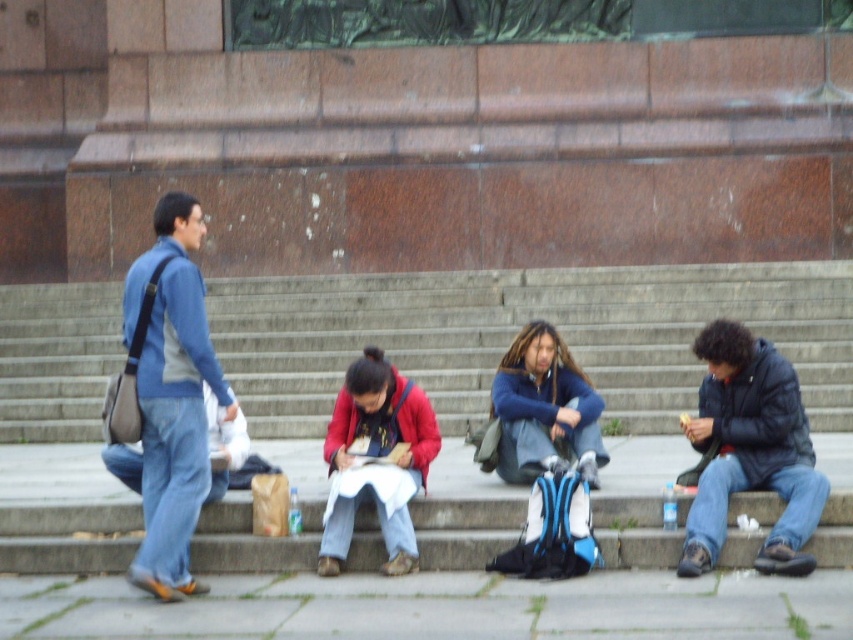
The image size is (853, 640). Identify the location of blue denim jeans at left. (172, 396).

Does point (202, 320) come in front of point (389, 488)?

Yes, it is in front of point (389, 488).

Is point (173, 259) closer to viewer compared to point (412, 536)?

No, (173, 259) is further to viewer.

The image size is (853, 640). I want to click on blue denim jeans at left, so click(172, 396).

Can you confirm if dark blue jacket at lower right is positioned below matte red jacket at center?

Actually, dark blue jacket at lower right is above matte red jacket at center.

In the scene shown: Who is taller, dark blue jacket at lower right or matte red jacket at center?

Standing taller between the two is dark blue jacket at lower right.

Is point (763, 552) positioned behind point (375, 476)?

No, it is not.

In order to click on dark blue jacket at lower right in this screenshot , I will do point(750,451).

Does gray concrete stairs at center appear over matte blue jacket at center?

Indeed, gray concrete stairs at center is positioned over matte blue jacket at center.

Is point (604, 349) behind point (502, 422)?

Yes, it is behind point (502, 422).

The image size is (853, 640). I want to click on gray concrete stairs at center, so 518,326.